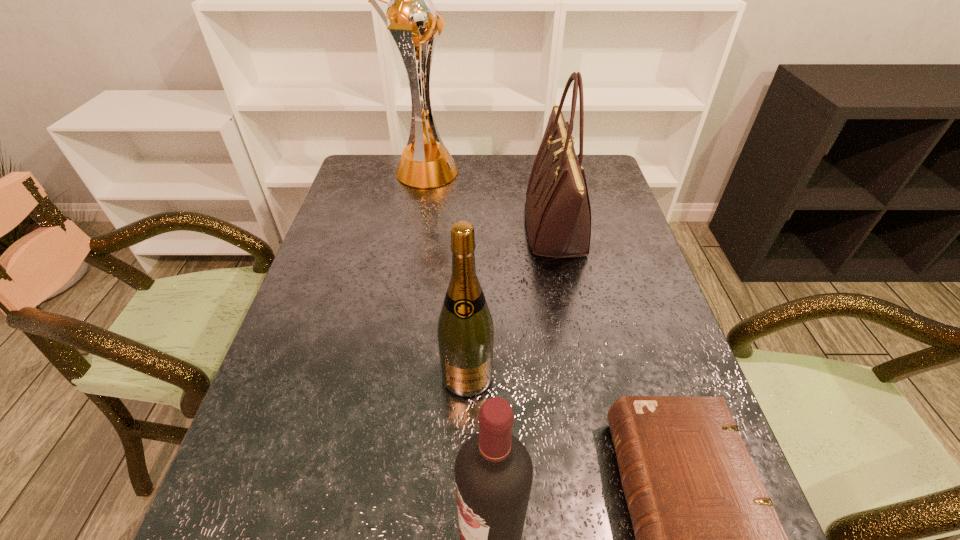
Locate an element on the screen. trophy is located at coordinates (410, 15).

Locate an element on the screen. The height and width of the screenshot is (540, 960). handbag is located at coordinates (558, 215).

At what (x,y) coordinates should I click in order to perform the action: click on the farther wine bottle. Please return your answer as a coordinate pair (x, y). Looking at the image, I should click on (465, 330).

Identify the location of vacant space located 0.190m on the front-facing side of the trophy. (514, 173).

Find the location of `free space located on the front-facing side of the handbag`. free space located on the front-facing side of the handbag is located at coordinates (446, 227).

At what (x,y) coordinates should I click in order to perform the action: click on free space located 0.080m on the front-facing side of the handbag. Please return your answer as a coordinate pair (x, y). Looking at the image, I should click on (498, 227).

Where is `vacant space located on the front-facing side of the handbag`? vacant space located on the front-facing side of the handbag is located at coordinates (460, 227).

Locate an element on the screen. free space located on the front-facing side of the farther wine bottle is located at coordinates (465, 500).

I want to click on trophy present at the far edge, so click(410, 15).

The height and width of the screenshot is (540, 960). I want to click on handbag that is positioned at the far edge, so click(558, 215).